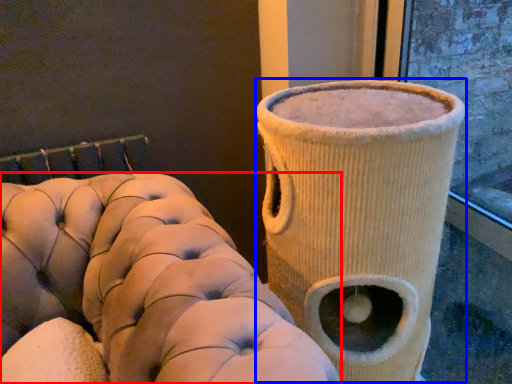
Question: Which object appears closest to the camera in this image, furniture (highlighted by a red box) or vase (highlighted by a blue box)?

Choices:
 (A) furniture
 (B) vase

Answer: (A)